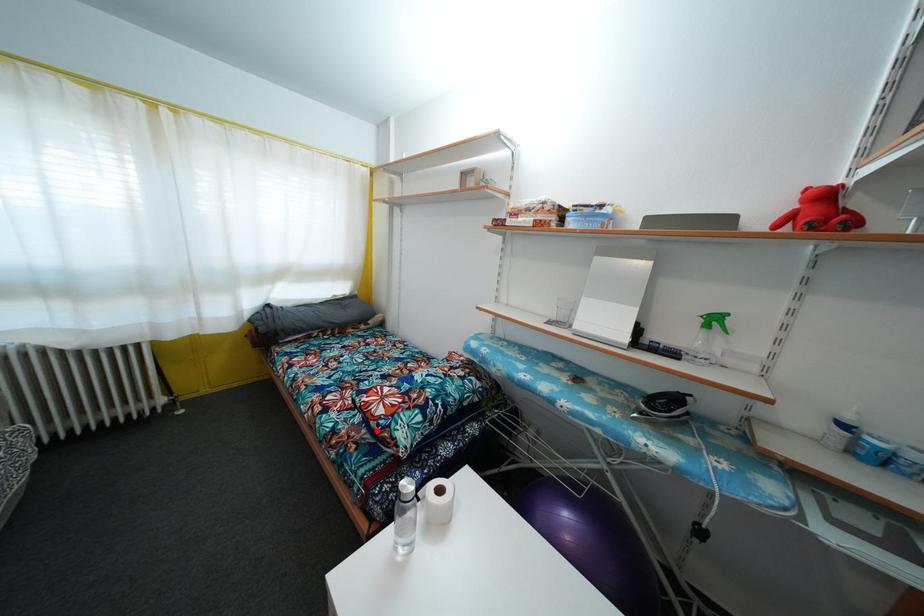
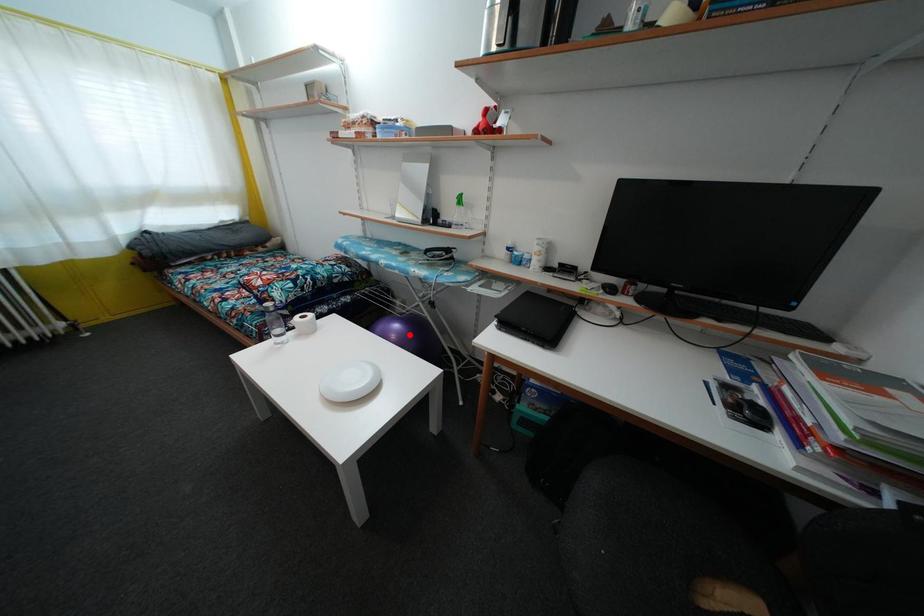
I am providing you with two images of the same scene from different viewpoints. A red point is marked on the first image and another point is marked on the second image. Does the point marked in image1 correspond to the same location as the one in image2?

No